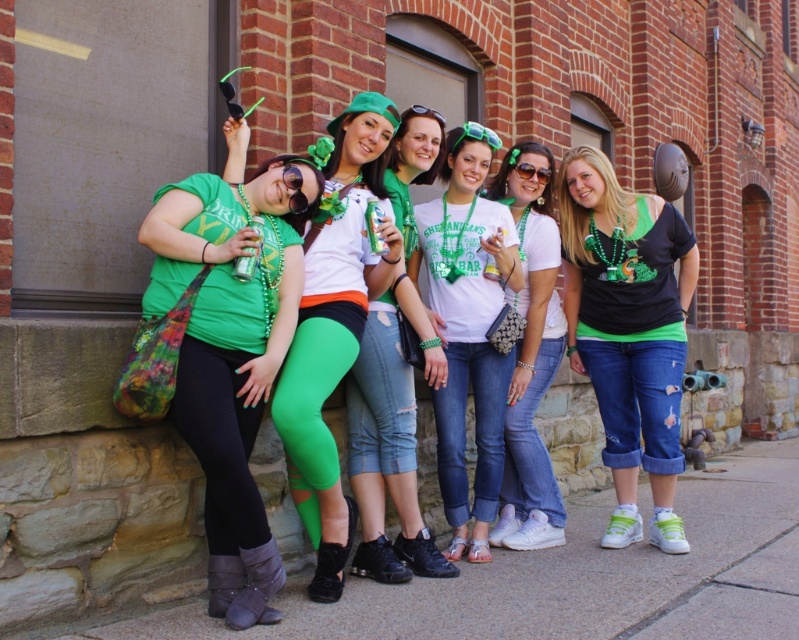
I want to click on white matte t-shirt at center, so click(x=467, y=328).

Is point (455, 141) positioned before point (549, 156)?

Yes, it is.

Where is `white matte t-shirt at center`? This screenshot has width=799, height=640. white matte t-shirt at center is located at coordinates (467, 328).

Who is positioned more to the left, matte black t-shirt with green accents at center or white matte t-shirt at center?

From the viewer's perspective, white matte t-shirt at center appears more on the left side.

Is point (614, 188) positioned after point (471, 330)?

Yes, point (614, 188) is farther from viewer.

Identify the location of matte black t-shirt with green accents at center. The width and height of the screenshot is (799, 640). (627, 332).

Does white matte t-shirt at center come behind matte green t-shirt at center?

Yes.

Who is more distant from viewer, (487, 353) or (360, 573)?

The point (487, 353) is more distant.

Is point (483, 477) positioned before point (360, 365)?

No.

Locate an element on the screen. The height and width of the screenshot is (640, 799). white matte t-shirt at center is located at coordinates (467, 328).